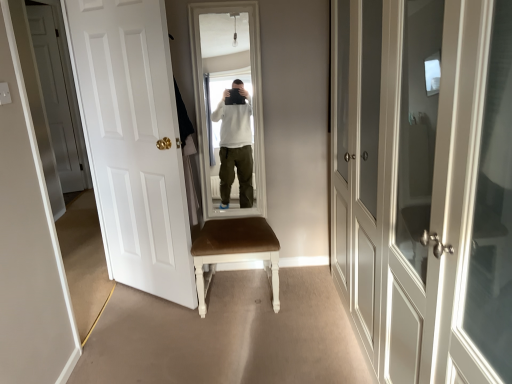
Question: Based on their positions, is white glossy door at left, acting as the second door starting from the back, located to the left or right of brown leather chair at center?

Choices:
 (A) right
 (B) left

Answer: (B)

Question: From the image's perspective, relative to brown leather chair at center, is white glossy door at left, acting as the second door starting from the back, above or below?

Choices:
 (A) below
 (B) above

Answer: (B)

Question: Which object is the closest to the white matte door at left, the 1th door when ordered from left to right?

Choices:
 (A) white glossy door at left, the 2th door in the left-to-right sequence
 (B) brown leather chair at center
 (C) white glossy cabinet doors at right, which is the third door in back-to-front order

Answer: (A)

Question: Considering the real-world distances, which object is farthest from the white glossy door at left, the 2th door in the left-to-right sequence?

Choices:
 (A) brown leather chair at center
 (B) white glossy cabinet doors at right, which is the third door in back-to-front order
 (C) white matte door at left, which is the third door in right-to-left order

Answer: (C)